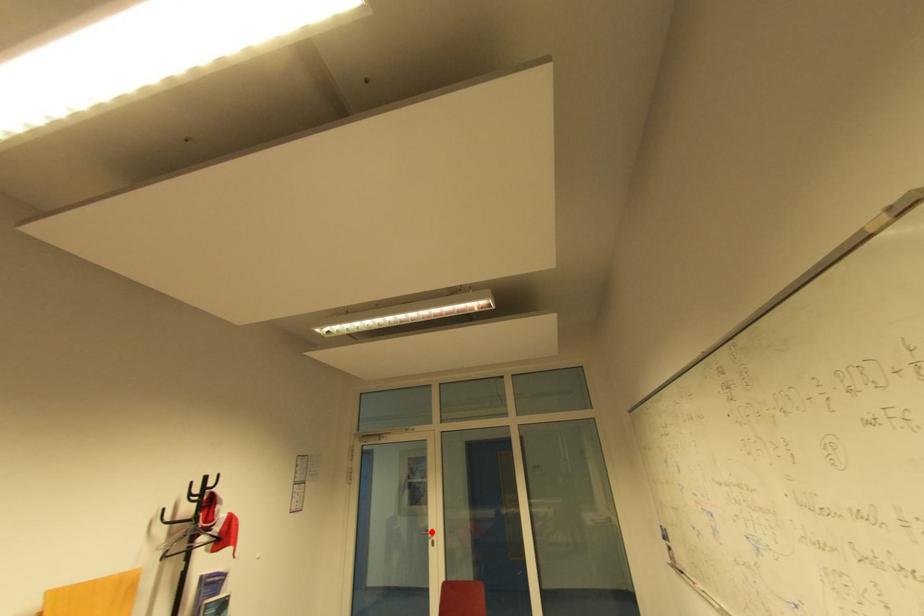
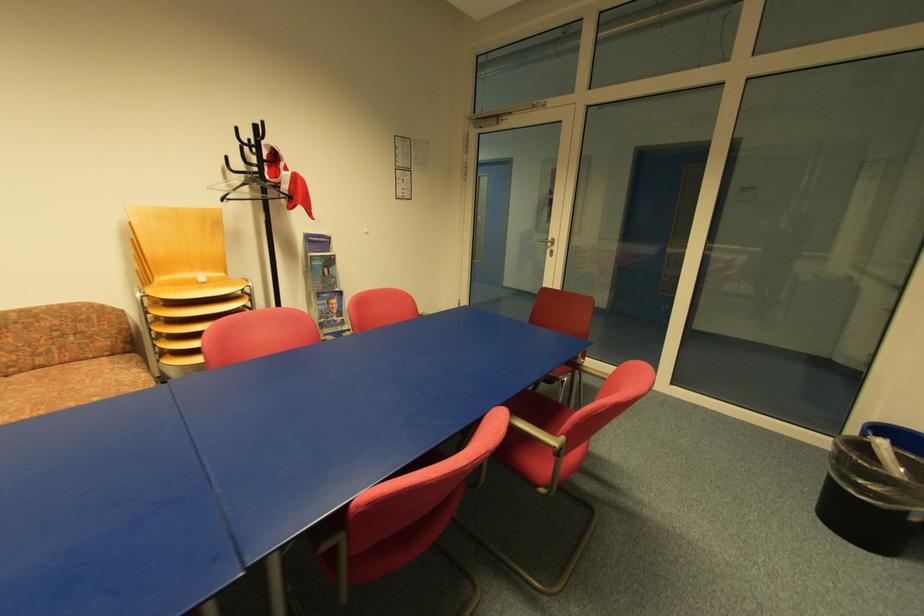
Locate, in the second image, the point that corresponds to the highlighted location in the first image.

(551, 241)